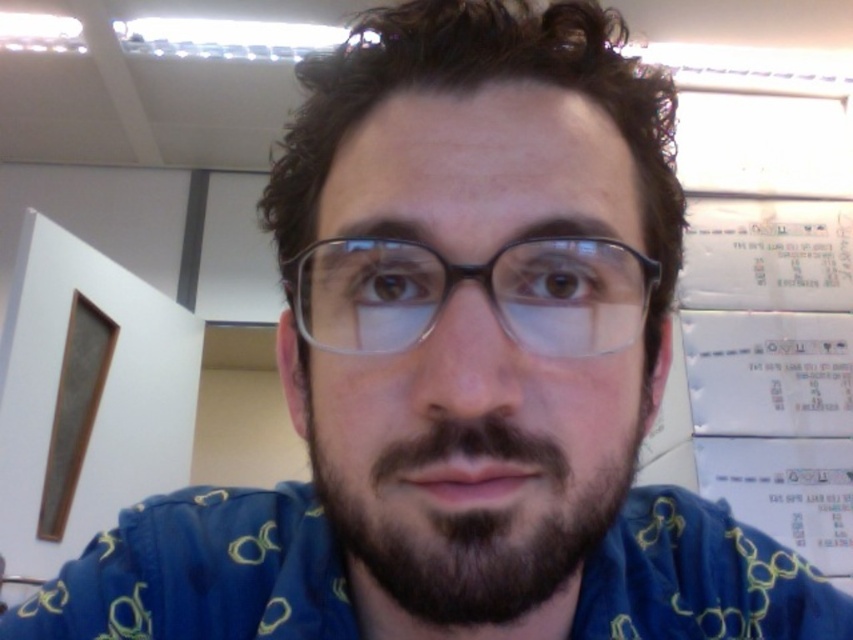
Question: Considering the real-world distances, which object is farthest from the dark brown fuzzy beard at center?

Choices:
 (A) white paper at upper right
 (B) transparent plastic glasses at center

Answer: (A)

Question: Estimate the real-world distances between objects in this image. Which object is closer to the dark brown fuzzy beard at center?

Choices:
 (A) white paper at upper right
 (B) transparent plastic glasses at center

Answer: (B)

Question: Among these objects, which one is nearest to the camera?

Choices:
 (A) transparent plastic glasses at center
 (B) white paper at upper right
 (C) dark brown fuzzy beard at center

Answer: (C)

Question: Is white paper at upper right above dark brown fuzzy beard at center?

Choices:
 (A) no
 (B) yes

Answer: (B)

Question: In this image, where is white paper at upper right located relative to dark brown fuzzy beard at center?

Choices:
 (A) left
 (B) right

Answer: (B)

Question: Is dark brown fuzzy beard at center to the right of transparent plastic glasses at center from the viewer's perspective?

Choices:
 (A) no
 (B) yes

Answer: (B)